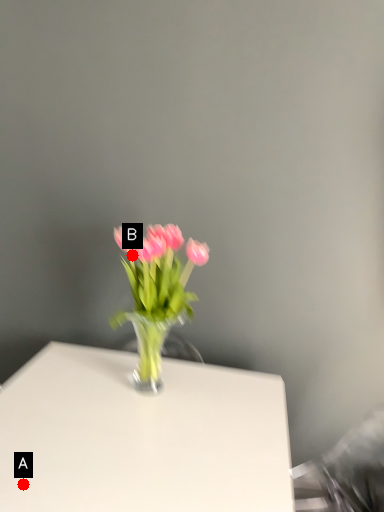
Question: Two points are circled on the image, labeled by A and B beside each circle. Which point appears closest to the camera in this image?

Choices:
 (A) A is closer
 (B) B is closer

Answer: (A)